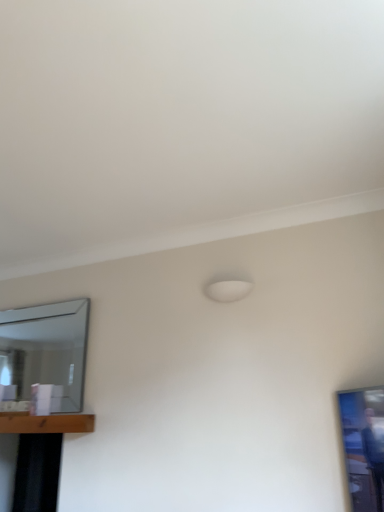
Find the location of a particular element. The width and height of the screenshot is (384, 512). clear glass mirror at left is located at coordinates (46, 349).

In order to click on black matte table at lower left, the 1th table ordered from the bottom in this screenshot , I will do `click(40, 456)`.

Measure the distance between point (x=23, y=480) and camera.

The distance of point (x=23, y=480) from camera is 2.92 meters.

Locate an element on the screen. clear glass mirror at left is located at coordinates (46, 349).

How far apart are black matte table at lower left, the 1th table ordered from the bottom, and brown wooden table at lower left, which is the second table from bottom to top?

black matte table at lower left, the 1th table ordered from the bottom, and brown wooden table at lower left, which is the second table from bottom to top, are 16.01 inches apart.

Between black matte table at lower left, the 1th table ordered from the bottom, and brown wooden table at lower left, which appears as the first table when viewed from the top, which one is positioned in front?

brown wooden table at lower left, which appears as the first table when viewed from the top.

From a real-world perspective, between black matte table at lower left, the 1th table ordered from the bottom, and brown wooden table at lower left, which appears as the first table when viewed from the top, who is vertically lower?

From a 3D spatial view, black matte table at lower left, the 1th table ordered from the bottom, is below.

Which object is thinner, black matte table at lower left, positioned as the second table in top-to-bottom order, or brown wooden table at lower left, which is the second table from bottom to top?

With smaller width is brown wooden table at lower left, which is the second table from bottom to top.

What's the angular difference between brown wooden table at lower left, which is the second table from bottom to top, and clear glass mirror at left's facing directions?

brown wooden table at lower left, which is the second table from bottom to top, and clear glass mirror at left are facing 0.11 degrees away from each other.

Is brown wooden table at lower left, which appears as the first table when viewed from the top, looking in the opposite direction of clear glass mirror at left?

No, brown wooden table at lower left, which appears as the first table when viewed from the top,'s orientation is not away from clear glass mirror at left.

Is brown wooden table at lower left, which appears as the first table when viewed from the top, not near clear glass mirror at left?

No, there isn't a large distance between brown wooden table at lower left, which appears as the first table when viewed from the top, and clear glass mirror at left.

Considering the relative sizes of brown wooden table at lower left, which is the second table from bottom to top, and clear glass mirror at left in the image provided, is brown wooden table at lower left, which is the second table from bottom to top, thinner than clear glass mirror at left?

No.

Is black matte table at lower left, positioned as the second table in top-to-bottom order, located outside clear glass mirror at left?

black matte table at lower left, positioned as the second table in top-to-bottom order, lies outside clear glass mirror at left's area.

Can you confirm if black matte table at lower left, positioned as the second table in top-to-bottom order, is positioned to the left of clear glass mirror at left?

Yes.

Which is closer to the camera, (13, 507) or (20, 367)?

Point (13, 507) is positioned closer to the camera compared to point (20, 367).

Can you confirm if black matte table at lower left, positioned as the second table in top-to-bottom order, is bigger than clear glass mirror at left?

Yes.

Consider the image. Are clear glass mirror at left and black matte table at lower left, positioned as the second table in top-to-bottom order, located far from each other?

Actually, clear glass mirror at left and black matte table at lower left, positioned as the second table in top-to-bottom order, are a little close together.

Looking at this image, what's the angular difference between clear glass mirror at left and black matte table at lower left, the 1th table ordered from the bottom,'s facing directions?

clear glass mirror at left and black matte table at lower left, the 1th table ordered from the bottom, are facing 0.406 degrees away from each other.

Is clear glass mirror at left completely or partially outside of black matte table at lower left, positioned as the second table in top-to-bottom order?

Indeed, clear glass mirror at left is completely outside black matte table at lower left, positioned as the second table in top-to-bottom order.

Is point (71, 319) positioned before point (3, 415)?

No, it is not.

Can you tell me how much clear glass mirror at left and brown wooden table at lower left, which is the second table from bottom to top, differ in facing direction?

There is a 0.11-degree angle between the facing directions of clear glass mirror at left and brown wooden table at lower left, which is the second table from bottom to top.

Is clear glass mirror at left behind brown wooden table at lower left, which is the second table from bottom to top?

Yes, the depth of clear glass mirror at left is greater than that of brown wooden table at lower left, which is the second table from bottom to top.

Considering the sizes of objects clear glass mirror at left and brown wooden table at lower left, which is the second table from bottom to top, in the image provided, who is taller, clear glass mirror at left or brown wooden table at lower left, which is the second table from bottom to top,?

Standing taller between the two is clear glass mirror at left.

From the image's perspective, is clear glass mirror at left located above or below brown wooden table at lower left, which appears as the first table when viewed from the top?

clear glass mirror at left is situated higher than brown wooden table at lower left, which appears as the first table when viewed from the top, in the image.

Who is taller, brown wooden table at lower left, which is the second table from bottom to top, or black matte table at lower left, positioned as the second table in top-to-bottom order?

With more height is black matte table at lower left, positioned as the second table in top-to-bottom order.

From the picture: Which point is more forward, [20,412] or [56,497]?

The point [56,497] is more forward.

Which object is thinner, brown wooden table at lower left, which appears as the first table when viewed from the top, or black matte table at lower left, the 1th table ordered from the bottom?

brown wooden table at lower left, which appears as the first table when viewed from the top.

From the image's perspective, is brown wooden table at lower left, which is the second table from bottom to top, beneath black matte table at lower left, the 1th table ordered from the bottom?

No, from the image's perspective, brown wooden table at lower left, which is the second table from bottom to top, is not below black matte table at lower left, the 1th table ordered from the bottom.

The width and height of the screenshot is (384, 512). I want to click on table located underneath the brown wooden table at lower left, which appears as the first table when viewed from the top (from a real-world perspective), so click(x=40, y=456).

Starting from the clear glass mirror at left, which table is the 2nd one in front? Please provide its 2D coordinates.

[(46, 423)]

Estimate the real-world distances between objects in this image. Which object is further from clear glass mirror at left, black matte table at lower left, the 1th table ordered from the bottom, or brown wooden table at lower left, which appears as the first table when viewed from the top?

black matte table at lower left, the 1th table ordered from the bottom, is further to clear glass mirror at left.

Based on their spatial positions, is black matte table at lower left, the 1th table ordered from the bottom, or clear glass mirror at left further from brown wooden table at lower left, which is the second table from bottom to top?

black matte table at lower left, the 1th table ordered from the bottom.

Which object lies nearer to the anchor point black matte table at lower left, the 1th table ordered from the bottom, brown wooden table at lower left, which is the second table from bottom to top, or clear glass mirror at left?

The object closer to black matte table at lower left, the 1th table ordered from the bottom, is brown wooden table at lower left, which is the second table from bottom to top.

Which object lies nearer to the anchor point brown wooden table at lower left, which appears as the first table when viewed from the top, clear glass mirror at left or black matte table at lower left, the 1th table ordered from the bottom?

clear glass mirror at left.

Based on the photo, from the image, which object appears to be farther from clear glass mirror at left, brown wooden table at lower left, which appears as the first table when viewed from the top, or black matte table at lower left, positioned as the second table in top-to-bottom order?

black matte table at lower left, positioned as the second table in top-to-bottom order, is further to clear glass mirror at left.

Estimate the real-world distances between objects in this image. Which object is closer to black matte table at lower left, positioned as the second table in top-to-bottom order, clear glass mirror at left or brown wooden table at lower left, which is the second table from bottom to top?

The object closer to black matte table at lower left, positioned as the second table in top-to-bottom order, is brown wooden table at lower left, which is the second table from bottom to top.

Locate an element on the screen. table between clear glass mirror at left and black matte table at lower left, positioned as the second table in top-to-bottom order, in the up-down direction is located at coordinates (46, 423).